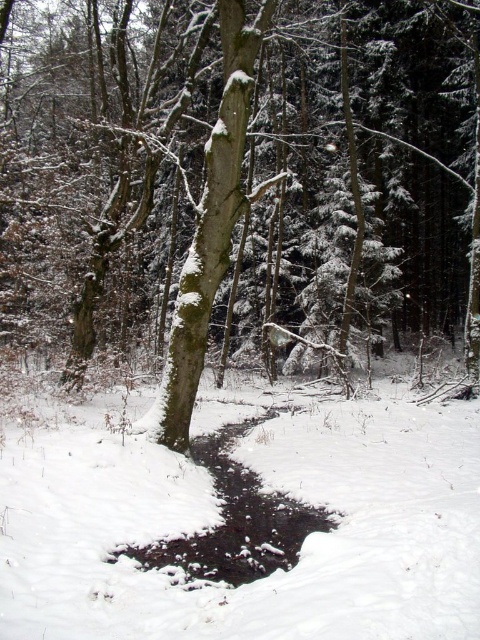
Can you confirm if white powdery snow at center is bigger than white textured bark at center?

Yes.

Is white powdery snow at center taller than white textured bark at center?

In fact, white powdery snow at center may be shorter than white textured bark at center.

Which is in front, point (322, 589) or point (200, 289)?

Point (322, 589) is more forward.

At what (x,y) coordinates should I click in order to perform the action: click on white powdery snow at center. Please return your answer as a coordinate pair (x, y). Looking at the image, I should click on (222, 522).

Is white textured bark at center below black ice puddle at lower center?

No.

Between white textured bark at center and black ice puddle at lower center, which one is positioned lower?

black ice puddle at lower center

Between point (230, 209) and point (248, 536), which one is positioned in front?

Positioned in front is point (248, 536).

The image size is (480, 640). I want to click on white textured bark at center, so click(211, 227).

Locate an element on the screen. snow-covered tree at center is located at coordinates (241, 173).

Who is shorter, snow-covered tree at center or black ice puddle at lower center?

black ice puddle at lower center

This screenshot has height=640, width=480. In order to click on snow-covered tree at center in this screenshot , I will do `click(241, 173)`.